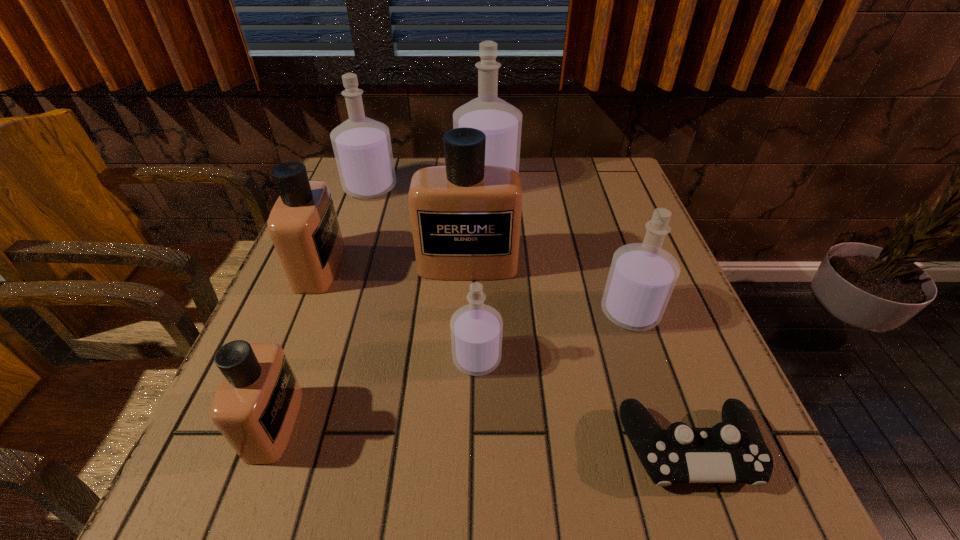
Select which object is the sixth closest to the third biggest purple perfume. Please provide its 2D coordinates. Your answer should be formatted as a tuple, i.e. [(x, y)], where the tuple contains the x and y coordinates of a point satisfying the conditions above.

[(303, 225)]

I want to click on object that is the third closest to the nearest perfume, so click(x=466, y=216).

Image resolution: width=960 pixels, height=540 pixels. In order to click on the sixth closest perfume to the leftmost purple perfume in this screenshot , I will do `click(642, 276)`.

The width and height of the screenshot is (960, 540). Identify the location of perfume that stands as the closest to the leftmost purple perfume. (501, 122).

The height and width of the screenshot is (540, 960). I want to click on purple perfume object that ranks as the closest to the nearest perfume, so click(x=476, y=329).

Select which purple perfume appears as the third closest to the rightmost purple perfume. Please provide its 2D coordinates. Your answer should be formatted as a tuple, i.e. [(x, y)], where the tuple contains the x and y coordinates of a point satisfying the conditions above.

[(362, 147)]

Locate an element on the screen. the third closest beige perfume relative to the third biggest purple perfume is located at coordinates (303, 225).

Locate an element on the screen. The width and height of the screenshot is (960, 540). the second closest beige perfume relative to the nearest purple perfume is located at coordinates (255, 408).

The height and width of the screenshot is (540, 960). Identify the location of vacant position in the image that satisfies the following two spatial constraints: 1. on the front side of the third nearest object; 2. on the front label of the nearest perfume. (476, 424).

Locate an element on the screen. This screenshot has height=540, width=960. free point that satisfies the following two spatial constraints: 1. on the front label of the biggest beige perfume; 2. on the front label of the nearest beige perfume is located at coordinates (463, 424).